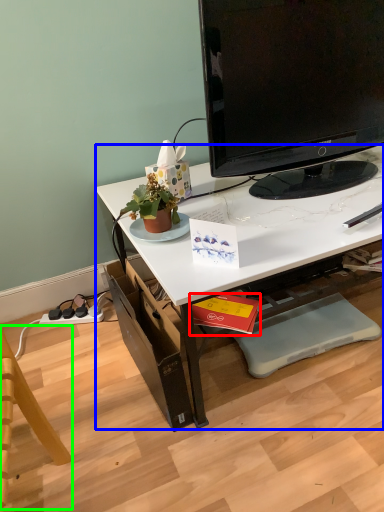
Question: Estimate the real-world distances between objects in this image. Which object is closer to book (highlighted by a red box), desk (highlighted by a blue box) or swivel chair (highlighted by a green box)?

Choices:
 (A) desk
 (B) swivel chair

Answer: (A)